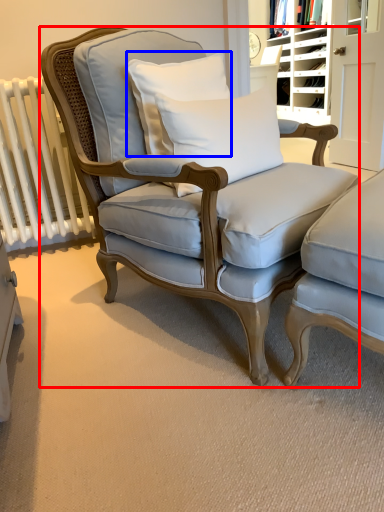
Question: Which object is further to the camera taking this photo, chair (highlighted by a red box) or pillow (highlighted by a blue box)?

Choices:
 (A) chair
 (B) pillow

Answer: (B)